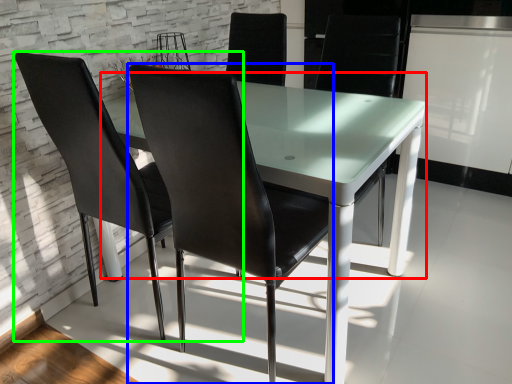
Question: Which object is positioned closest to round table (highlighted by a red box)? Select from chair (highlighted by a blue box) and chair (highlighted by a green box).

Choices:
 (A) chair
 (B) chair

Answer: (A)